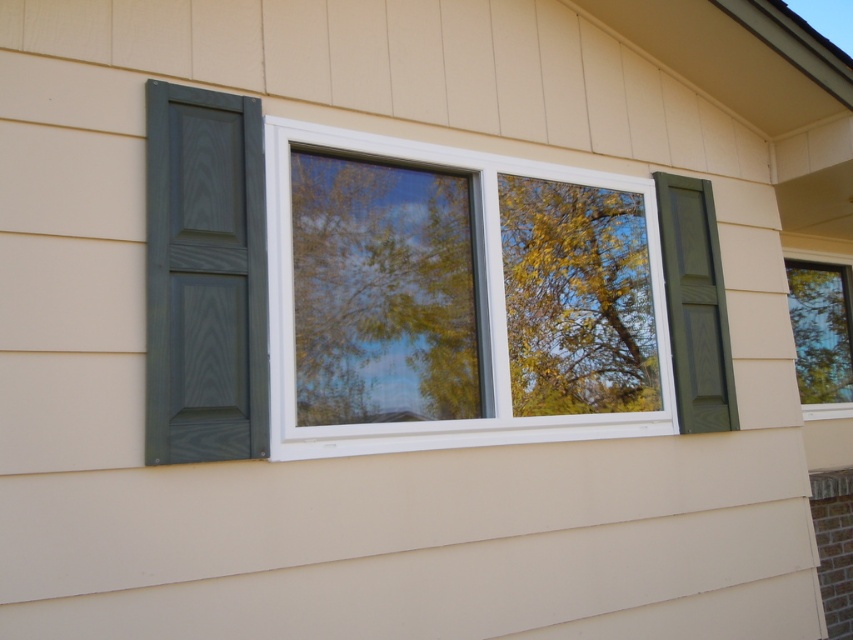
Is green wood tree at center taller than transparent glass window at center?

In fact, green wood tree at center may be shorter than transparent glass window at center.

Is point (416, 404) behind point (824, 332)?

No.

The height and width of the screenshot is (640, 853). I want to click on green wood tree at center, so click(463, 292).

Does green wood shutter at right appear over transparent glass window at center?

Yes, green wood shutter at right is above transparent glass window at center.

Is green wood shutter at right wider than transparent glass window at center?

In fact, green wood shutter at right might be narrower than transparent glass window at center.

At what (x,y) coordinates should I click in order to perform the action: click on green wood shutter at right. Please return your answer as a coordinate pair (x, y). This screenshot has width=853, height=640. Looking at the image, I should click on (695, 305).

Is matte wood shutter at left thinner than transparent glass window at center?

Yes.

Can you confirm if matte wood shutter at left is smaller than transparent glass window at center?

Indeed, matte wood shutter at left has a smaller size compared to transparent glass window at center.

The height and width of the screenshot is (640, 853). Identify the location of matte wood shutter at left. (204, 276).